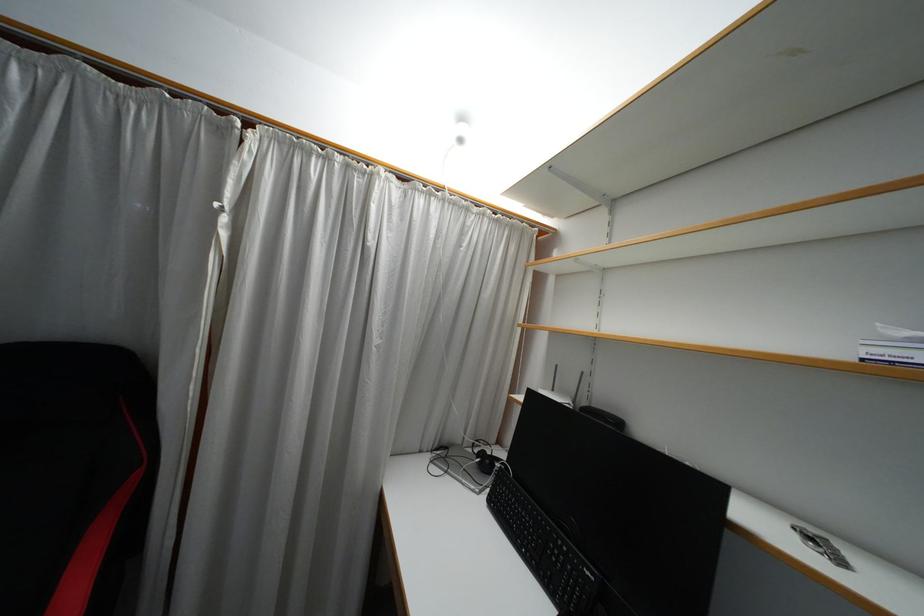
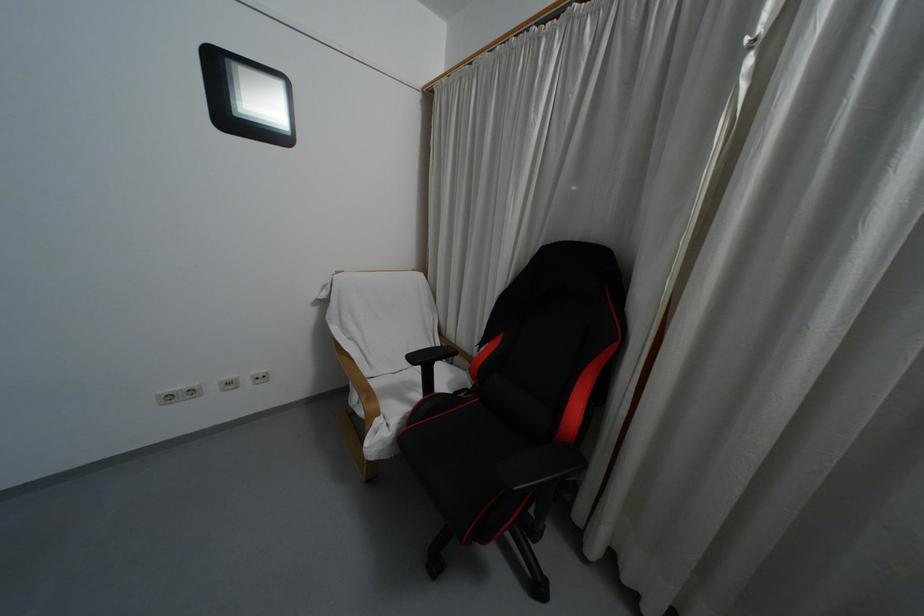
Question: The camera is either moving clockwise (left) or counter-clockwise (right) around the object. The first image is from the beginning of the video and the second image is from the end. Is the camera moving left or right when shooting the video?

Choices:
 (A) Left
 (B) Right

Answer: (B)